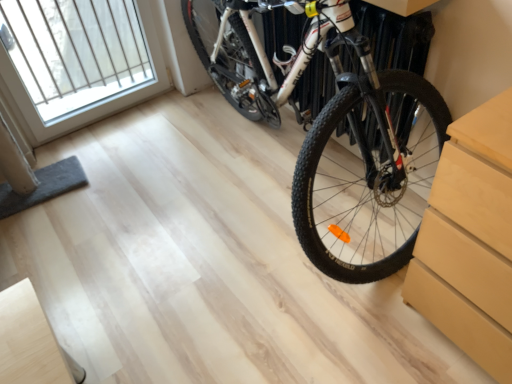
Where is `white glass window at upper left`? white glass window at upper left is located at coordinates (78, 61).

What do you see at coordinates (78, 61) in the screenshot? I see `white glass window at upper left` at bounding box center [78, 61].

What is the approximate height of white glass window at upper left?

white glass window at upper left is 30.09 inches tall.

The height and width of the screenshot is (384, 512). What do you see at coordinates (333, 127) in the screenshot?
I see `shiny white bicycle at center` at bounding box center [333, 127].

The width and height of the screenshot is (512, 384). In order to click on shiny white bicycle at center in this screenshot , I will do `click(333, 127)`.

Find the location of a particular element. white glass window at upper left is located at coordinates (78, 61).

Visually, is white glass window at upper left positioned to the left or to the right of shiny white bicycle at center?

Clearly, white glass window at upper left is on the left of shiny white bicycle at center in the image.

Relative to shiny white bicycle at center, is white glass window at upper left in front or behind?

white glass window at upper left is behind shiny white bicycle at center.

Which is in front, point (109, 88) or point (283, 16)?

Positioned in front is point (283, 16).

From the picture: From the image's perspective, is white glass window at upper left located beneath shiny white bicycle at center?

No, from the image's perspective, white glass window at upper left is not below shiny white bicycle at center.

From a real-world perspective, which is physically above, white glass window at upper left or shiny white bicycle at center?

shiny white bicycle at center, from a real-world perspective.

Can you confirm if white glass window at upper left is thinner than shiny white bicycle at center?

Indeed, white glass window at upper left has a lesser width compared to shiny white bicycle at center.

Looking at this image, considering the sizes of white glass window at upper left and shiny white bicycle at center in the image, is white glass window at upper left taller or shorter than shiny white bicycle at center?

In the image, white glass window at upper left appears to be shorter than shiny white bicycle at center.

Which of these two, white glass window at upper left or shiny white bicycle at center, is smaller?

With smaller size is white glass window at upper left.

Is shiny white bicycle at center a part of white glass window at upper left?

No, shiny white bicycle at center is not inside white glass window at upper left.

Is white glass window at upper left far away from shiny white bicycle at center?

They are positioned close to each other.

Is white glass window at upper left looking in the opposite direction of shiny white bicycle at center?

No, shiny white bicycle at center is not at the back of white glass window at upper left.

At what (x,y) coordinates should I click in order to perform the action: click on window located underneath the shiny white bicycle at center (from a real-world perspective). Please return your answer as a coordinate pair (x, y). The height and width of the screenshot is (384, 512). Looking at the image, I should click on (78, 61).

Between shiny white bicycle at center and white glass window at upper left, which one appears on the right side from the viewer's perspective?

shiny white bicycle at center.

Which object is further away from the camera, shiny white bicycle at center or white glass window at upper left?

white glass window at upper left.

Which is more distant, (x=357, y=82) or (x=20, y=22)?

The point (x=20, y=22) is behind.

From the image's perspective, is shiny white bicycle at center under white glass window at upper left?

Yes, from the image's perspective, shiny white bicycle at center is below white glass window at upper left.

From a real-world perspective, which object stands above the other?

From a 3D spatial view, shiny white bicycle at center is above.

Can you confirm if shiny white bicycle at center is wider than white glass window at upper left?

Indeed, shiny white bicycle at center has a greater width compared to white glass window at upper left.

Is shiny white bicycle at center taller than white glass window at upper left?

Correct, shiny white bicycle at center is much taller as white glass window at upper left.

Considering the sizes of shiny white bicycle at center and white glass window at upper left in the image, is shiny white bicycle at center bigger or smaller than white glass window at upper left?

Clearly, shiny white bicycle at center is larger in size than white glass window at upper left.

Based on the photo, which is correct: shiny white bicycle at center is inside white glass window at upper left, or outside of it?

The correct answer is: outside.

Is shiny white bicycle at center in contact with white glass window at upper left?

No, shiny white bicycle at center is not touching white glass window at upper left.

Is shiny white bicycle at center oriented away from white glass window at upper left?

shiny white bicycle at center does not have its back to white glass window at upper left.

Can you tell me how much shiny white bicycle at center and white glass window at upper left differ in facing direction?

The angle between the facing direction of shiny white bicycle at center and the facing direction of white glass window at upper left is 89.6 degrees.

How much distance is there between shiny white bicycle at center and white glass window at upper left?

A distance of 38.67 inches exists between shiny white bicycle at center and white glass window at upper left.

Find the location of a particular element. This screenshot has height=384, width=512. window on the left of the shiny white bicycle at center is located at coordinates (78, 61).

Identify the location of bicycle in front of the white glass window at upper left. (333, 127).

The width and height of the screenshot is (512, 384). I want to click on window on the left of shiny white bicycle at center, so click(78, 61).